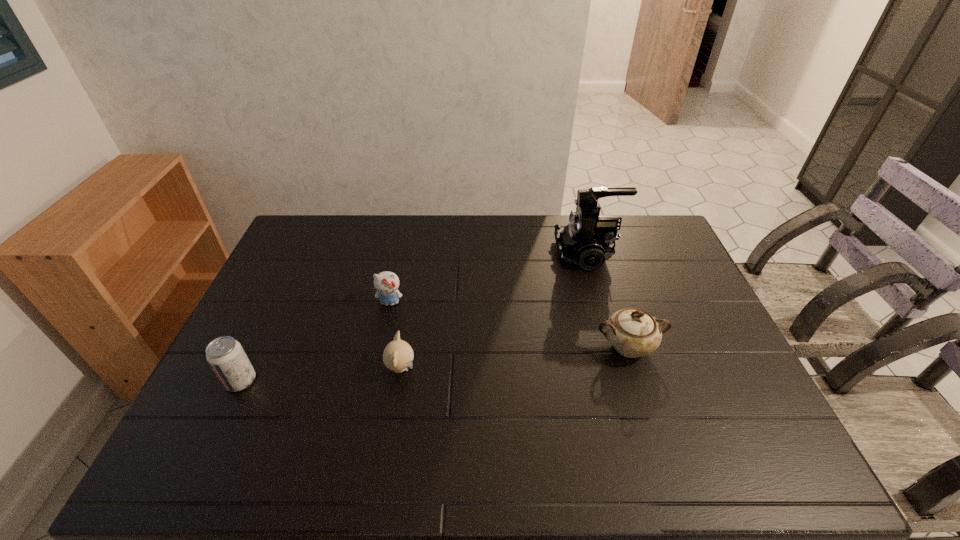
The image size is (960, 540). In order to click on vacant space that satisfies the following two spatial constraints: 1. on the lens mount of the farthest object; 2. on the front-facing side of the farther kitten in this screenshot , I will do click(x=601, y=302).

Locate an element on the screen. This screenshot has width=960, height=540. free point that satisfies the following two spatial constraints: 1. on the lens mount of the chinaware; 2. on the right side of the camcorder is located at coordinates (613, 347).

Find the location of a particular element. Image resolution: width=960 pixels, height=540 pixels. free space in the image that satisfies the following two spatial constraints: 1. on the lens mount of the farthest object; 2. on the right side of the chinaware is located at coordinates (613, 347).

This screenshot has width=960, height=540. Identify the location of vacant region that satisfies the following two spatial constraints: 1. on the back side of the soda can; 2. on the right side of the chinaware. (256, 347).

You are a GUI agent. You are given a task and a screenshot of the screen. Output one action in this format:
    pyautogui.click(x=<x>, y=<y>)
    Task: Click on the vacant area in the image that satisfies the following two spatial constraints: 1. on the front-facing side of the farther kitten; 2. on the right side of the chinaware
    
    Given the screenshot: What is the action you would take?
    pyautogui.click(x=380, y=347)